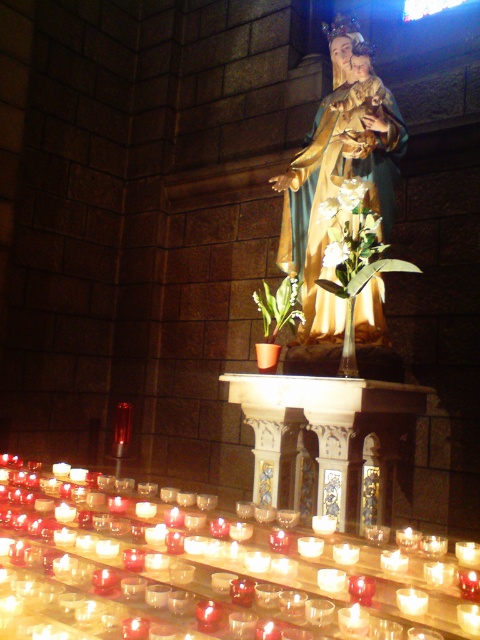
Is translucent glass candle at lower left positioned before white matte flower at center?

Yes, translucent glass candle at lower left is closer to the viewer.

Is translucent glass candle at lower left to the right of white matte flower at center from the viewer's perspective?

Incorrect, translucent glass candle at lower left is not on the right side of white matte flower at center.

This screenshot has height=640, width=480. What do you see at coordinates (228, 566) in the screenshot?
I see `translucent glass candle at lower left` at bounding box center [228, 566].

The width and height of the screenshot is (480, 640). In order to click on translucent glass candle at lower left in this screenshot , I will do `click(228, 566)`.

Between point (343, 316) and point (331, 259), which one is positioned in front?

Positioned in front is point (331, 259).

Can you confirm if gold polished statue at center is bigger than white matte flower at center?

Yes.

Is point (375, 83) positioned after point (339, 243)?

Yes.

Find the location of a particular element. gold polished statue at center is located at coordinates (337, 173).

Is translucent glass candle at lower left smaller than gold polished statue at center?

Yes, translucent glass candle at lower left is smaller than gold polished statue at center.

What do you see at coordinates (228, 566) in the screenshot?
I see `translucent glass candle at lower left` at bounding box center [228, 566].

Who is more forward, (472,618) or (340,328)?

Positioned in front is point (472,618).

Identify the location of translucent glass candle at lower left. The width and height of the screenshot is (480, 640). (228, 566).